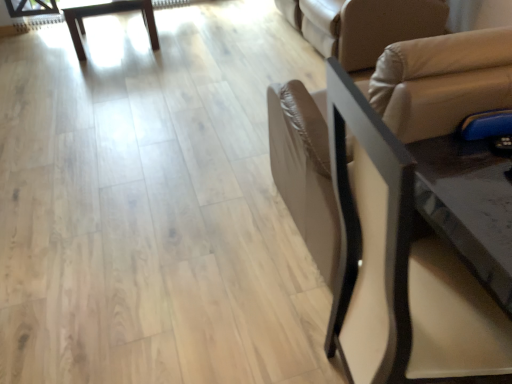
What are the coordinates of `vacant space underneath wooden table at upper left (from a real-world perspective)` in the screenshot? It's located at (114, 44).